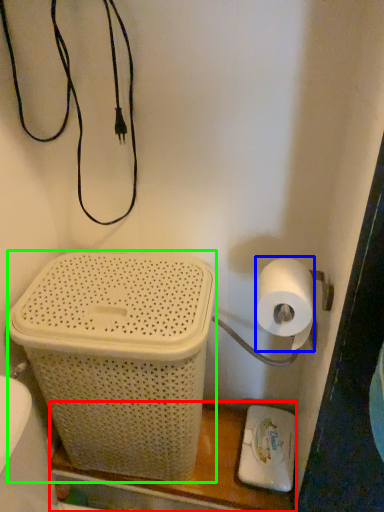
Question: Which is nearer to the shelf (highlighted by a red box)? toilet paper (highlighted by a blue box) or basket container (highlighted by a green box).

Choices:
 (A) toilet paper
 (B) basket container

Answer: (B)